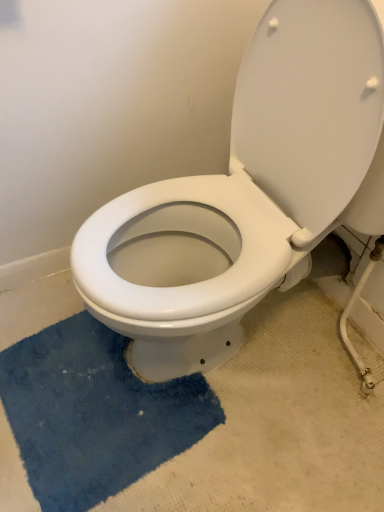
Find the location of a particular element. This screenshot has height=512, width=384. free space above blue plush bath mat at lower left (from a real-world perspective) is located at coordinates coord(92,396).